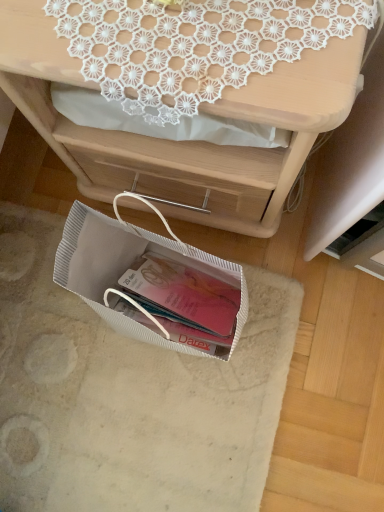
Question: Is white textured bag at lower center surrounded by white lace doily at upper center?

Choices:
 (A) no
 (B) yes

Answer: (A)

Question: Can you confirm if white lace doily at upper center is taller than white textured bag at lower center?

Choices:
 (A) yes
 (B) no

Answer: (A)

Question: Considering the relative sizes of white lace doily at upper center and white textured bag at lower center in the image provided, is white lace doily at upper center wider than white textured bag at lower center?

Choices:
 (A) yes
 (B) no

Answer: (B)

Question: Is white lace doily at upper center turned away from white textured bag at lower center?

Choices:
 (A) yes
 (B) no

Answer: (B)

Question: Is white lace doily at upper center further to the viewer compared to white textured bag at lower center?

Choices:
 (A) no
 (B) yes

Answer: (A)

Question: Is point [238, 86] closer or farther from the camera than point [170, 421]?

Choices:
 (A) farther
 (B) closer

Answer: (B)

Question: Based on their positions, is matte white desk at upper center located to the left or right of white textured bag at lower center?

Choices:
 (A) left
 (B) right

Answer: (B)

Question: Is matte white desk at upper center inside the boundaries of white textured bag at lower center, or outside?

Choices:
 (A) outside
 (B) inside

Answer: (A)

Question: In the image, is matte white desk at upper center positioned in front of or behind white textured bag at lower center?

Choices:
 (A) behind
 (B) front

Answer: (B)

Question: Which is correct: white lace doily at upper center is inside matte white desk at upper center, or outside of it?

Choices:
 (A) outside
 (B) inside

Answer: (B)

Question: Considering the positions of white lace doily at upper center and matte white desk at upper center in the image, is white lace doily at upper center bigger or smaller than matte white desk at upper center?

Choices:
 (A) small
 (B) big

Answer: (A)

Question: In terms of width, does white lace doily at upper center look wider or thinner when compared to matte white desk at upper center?

Choices:
 (A) thin
 (B) wide

Answer: (A)

Question: Considering the positions of white lace doily at upper center and matte white desk at upper center in the image, is white lace doily at upper center taller or shorter than matte white desk at upper center?

Choices:
 (A) tall
 (B) short

Answer: (B)

Question: Choose the correct answer: Is white textured bag at lower center inside matte white desk at upper center or outside it?

Choices:
 (A) inside
 (B) outside

Answer: (B)

Question: From the image's perspective, is white textured bag at lower center positioned above or below matte white desk at upper center?

Choices:
 (A) below
 (B) above

Answer: (A)